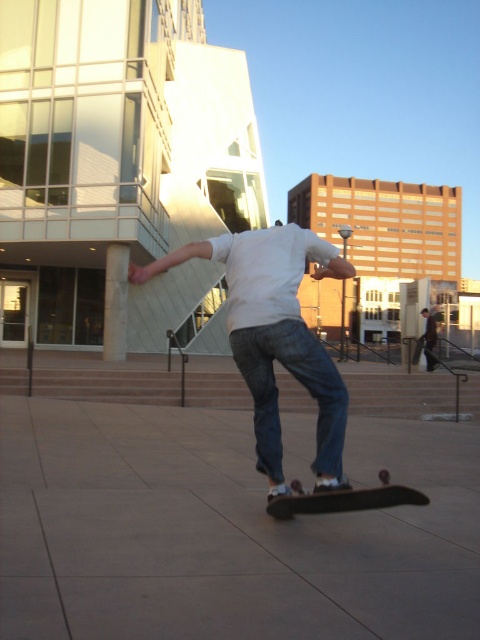
Does gray concrete pavement at center appear under white cotton shirt at center?

Indeed, gray concrete pavement at center is positioned under white cotton shirt at center.

Can you confirm if gray concrete pavement at center is positioned to the right of white cotton shirt at center?

No, gray concrete pavement at center is not to the right of white cotton shirt at center.

Where is `gray concrete pavement at center`? This screenshot has width=480, height=640. gray concrete pavement at center is located at coordinates (225, 531).

Is concrete stairs at center smaller than dark brown leather jacket at center?

No.

Locate an element on the screen. concrete stairs at center is located at coordinates (108, 385).

At what (x,y) coordinates should I click in order to perform the action: click on concrete stairs at center. Please return your answer as a coordinate pair (x, y). Image resolution: width=480 pixels, height=640 pixels. Looking at the image, I should click on (108, 385).

Does white cotton shirt at center come behind dark brown leather jacket at center?

No.

Which is above, white cotton shirt at center or dark brown leather jacket at center?

Positioned higher is white cotton shirt at center.

Which is in front, point (148, 275) or point (431, 324)?

Point (148, 275) is in front.

You are a GUI agent. You are given a task and a screenshot of the screen. Output one action in this format:
    pyautogui.click(x=<x>, y=<y>)
    Task: Click on the white cotton shirt at center
    This screenshot has height=640, width=480.
    Given the screenshot: What is the action you would take?
    point(276,333)